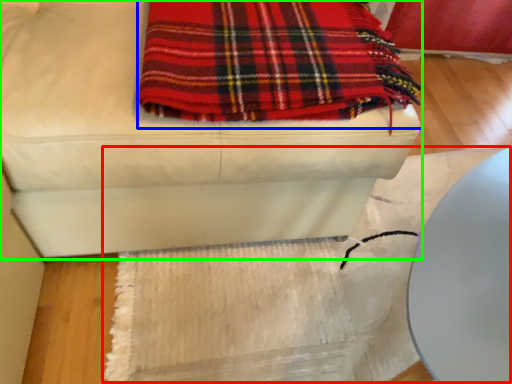
Question: Considering the real-world distances, which object is closest to mat (highlighted by a red box)? blanket (highlighted by a blue box) or furniture (highlighted by a green box).

Choices:
 (A) blanket
 (B) furniture

Answer: (B)